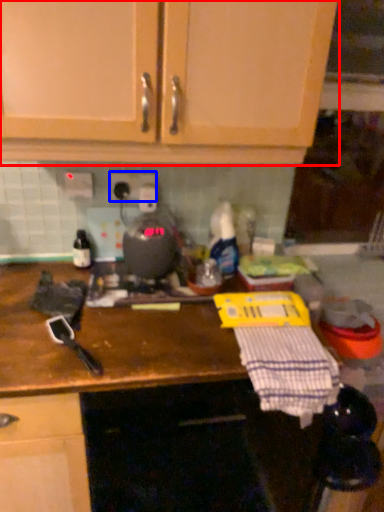
Question: Which point is closer to the camera, cabinetry (highlighted by a red box) or electric outlet (highlighted by a blue box)?

Choices:
 (A) cabinetry
 (B) electric outlet

Answer: (A)